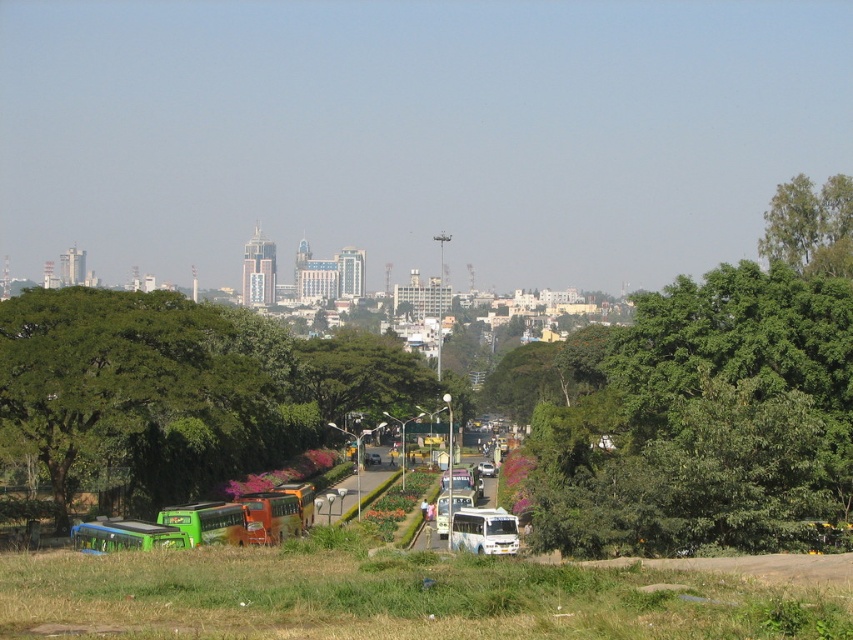
Question: Which of the following is the closest to the observer?

Choices:
 (A) green leafy tree at center
 (B) green leafy tree at upper right

Answer: (B)

Question: Does green leafy tree at center have a smaller size compared to green leafy tree at upper right?

Choices:
 (A) yes
 (B) no

Answer: (B)

Question: Does green leafy tree at center appear under green leafy tree at upper right?

Choices:
 (A) yes
 (B) no

Answer: (A)

Question: Which object is closer to the camera taking this photo?

Choices:
 (A) green leafy tree at upper right
 (B) green leafy tree at center

Answer: (A)

Question: Which of the following is the closest to the observer?

Choices:
 (A) (338, 340)
 (B) (778, 234)

Answer: (B)

Question: Can you confirm if green leafy tree at center is smaller than green leafy tree at upper right?

Choices:
 (A) no
 (B) yes

Answer: (A)